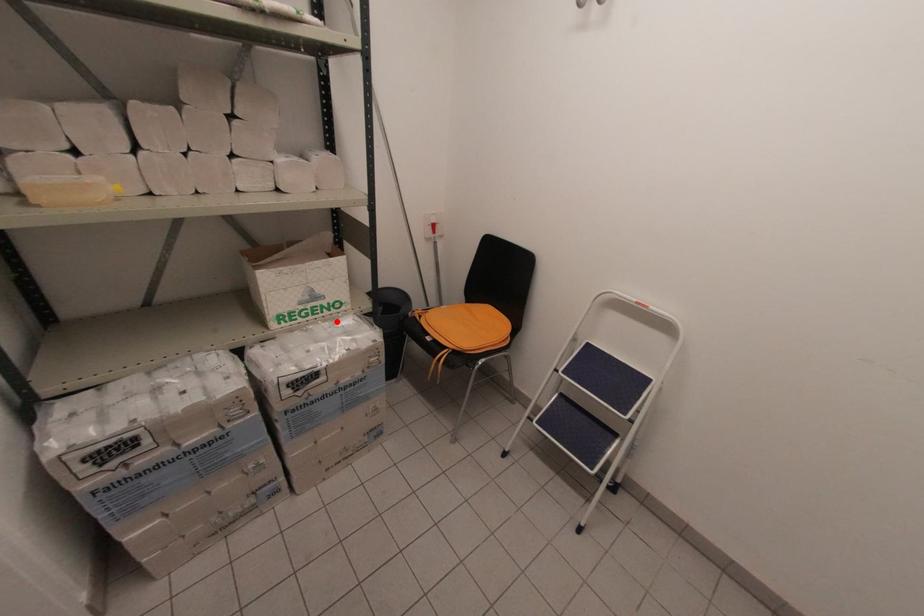
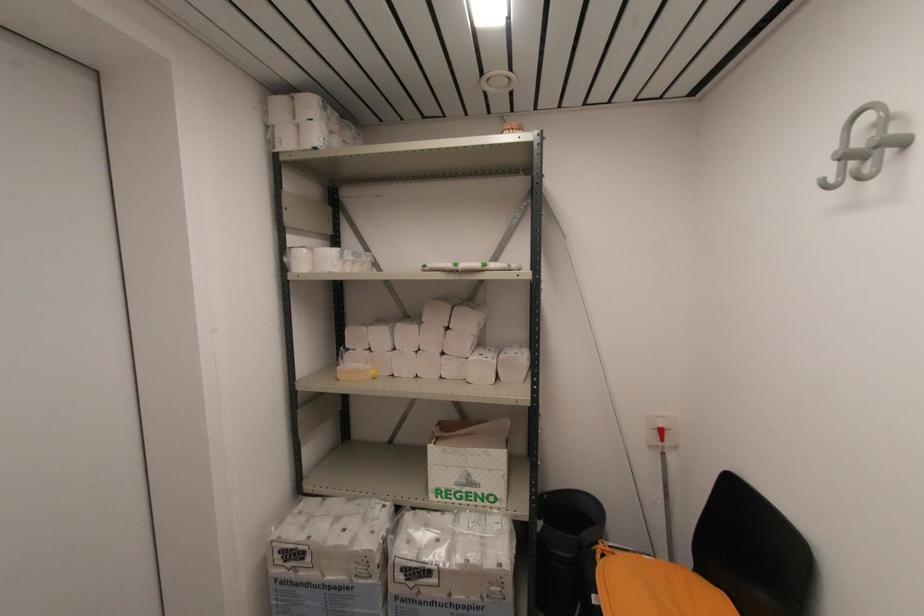
Question: I am providing you with two images of the same scene from different viewpoints. In image1, a red point is highlighted. Considering the same 3D point in image2, which of the following is correct?

Choices:
 (A) It is closer
 (B) It is farther

Answer: (B)